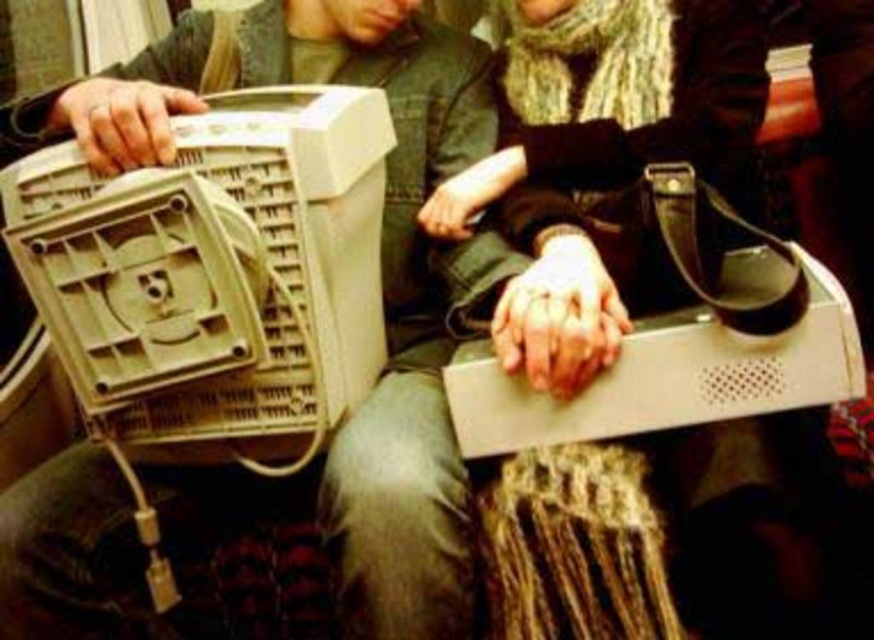
Question: Among these points, which one is nearest to the camera?

Choices:
 (A) click(x=281, y=22)
 (B) click(x=348, y=348)

Answer: (B)

Question: Is matte plastic monitor at left further to the viewer compared to beige plastic computer at left?

Choices:
 (A) yes
 (B) no

Answer: (A)

Question: Does matte plastic monitor at left have a lesser width compared to beige plastic computer at left?

Choices:
 (A) no
 (B) yes

Answer: (A)

Question: Does matte plastic monitor at left have a greater width compared to beige plastic computer at left?

Choices:
 (A) yes
 (B) no

Answer: (A)

Question: Among these objects, which one is nearest to the camera?

Choices:
 (A) matte plastic monitor at left
 (B) beige plastic computer at left

Answer: (B)